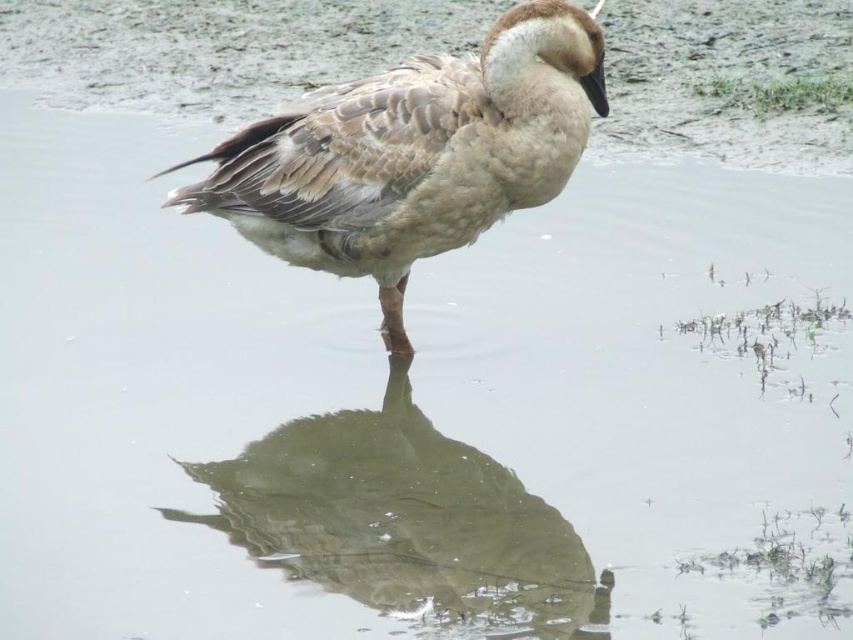
Question: Is brown speckled duck at center positioned at the back of greenish-gray reflective surface at center?

Choices:
 (A) no
 (B) yes

Answer: (B)

Question: Is brown speckled duck at center below greenish-gray reflective surface at center?

Choices:
 (A) yes
 (B) no

Answer: (B)

Question: Which point is farther from the camera taking this photo?

Choices:
 (A) (601, 68)
 (B) (483, 460)

Answer: (B)

Question: Which point appears farthest from the camera in this image?

Choices:
 (A) [x=451, y=154]
 (B) [x=587, y=557]

Answer: (A)

Question: Where is brown speckled duck at center located in relation to greenish-gray reflective surface at center in the image?

Choices:
 (A) above
 (B) below

Answer: (A)

Question: Which point appears farthest from the camera in this image?

Choices:
 (A) (190, 195)
 (B) (434, 556)

Answer: (A)